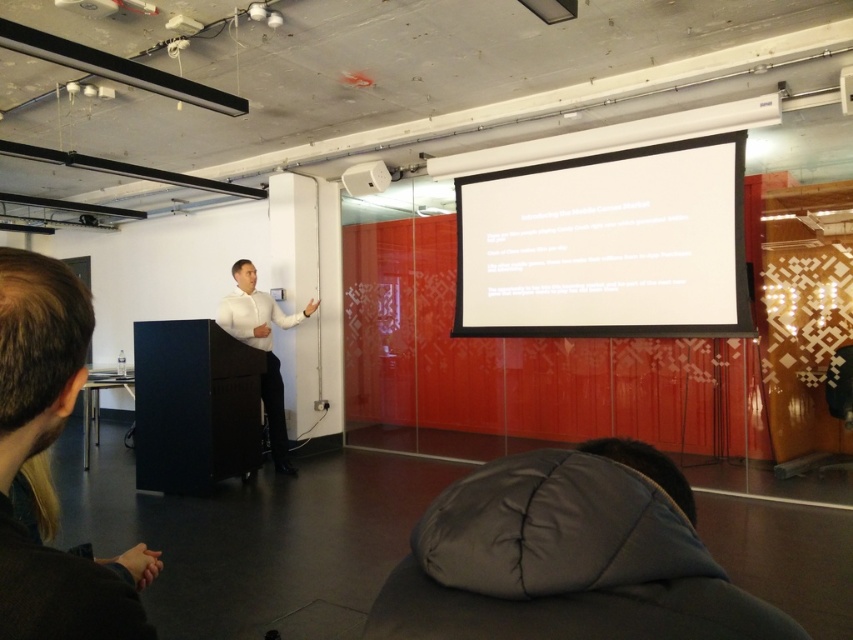
You are organizing an event and need to ensure that the white glossy shirt at center and the white plastic speaker at upper center are visible to the audience. Based on their sizes, which object should be placed closer to the back of the stage to maintain visibility?

The white glossy shirt at center is larger in size compared to the white plastic speaker at upper center. To maintain visibility, the larger white glossy shirt at center should be placed closer to the back of the stage so it remains visible over the smaller speaker.

You are an attendee at the presentation and need to locate the dark brown leather jacket at lower left. From your perspective, where is the white matte projection screen at upper center relative to the jacket?

The white matte projection screen at upper center is positioned over the dark brown leather jacket at lower left, meaning it is above and in front of the jacket from your viewpoint.